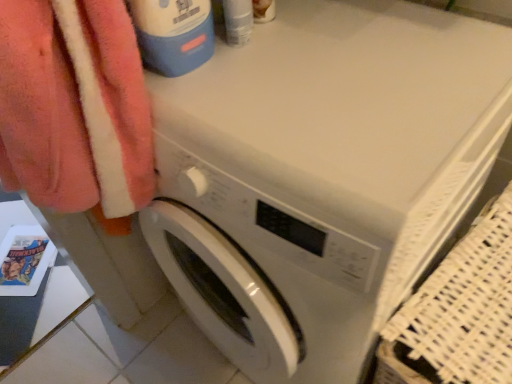
Question: Should I look upward or downward to see white glossy washing machine at center?

Choices:
 (A) down
 (B) up

Answer: (A)

Question: From a real-world perspective, is white glossy washing machine at center beneath blue plastic bottle at upper left?

Choices:
 (A) yes
 (B) no

Answer: (A)

Question: Is white glossy washing machine at center to the left of blue plastic bottle at upper left from the viewer's perspective?

Choices:
 (A) yes
 (B) no

Answer: (B)

Question: Does white glossy washing machine at center lie in front of blue plastic bottle at upper left?

Choices:
 (A) yes
 (B) no

Answer: (A)

Question: Is white glossy washing machine at center in contact with blue plastic bottle at upper left?

Choices:
 (A) yes
 (B) no

Answer: (B)

Question: From a real-world perspective, is white glossy washing machine at center positioned over blue plastic bottle at upper left based on gravity?

Choices:
 (A) no
 (B) yes

Answer: (A)

Question: From the image's perspective, is white glossy washing machine at center below blue plastic bottle at upper left?

Choices:
 (A) yes
 (B) no

Answer: (A)

Question: From a real-world perspective, is blue plastic bottle at upper left below white glossy washing machine at center?

Choices:
 (A) yes
 (B) no

Answer: (B)

Question: Is blue plastic bottle at upper left aimed at white glossy washing machine at center?

Choices:
 (A) yes
 (B) no

Answer: (B)

Question: Is blue plastic bottle at upper left wider than white glossy washing machine at center?

Choices:
 (A) no
 (B) yes

Answer: (A)

Question: From the image's perspective, would you say blue plastic bottle at upper left is shown under white glossy washing machine at center?

Choices:
 (A) no
 (B) yes

Answer: (A)

Question: Is blue plastic bottle at upper left looking in the opposite direction of white glossy washing machine at center?

Choices:
 (A) no
 (B) yes

Answer: (A)

Question: Is blue plastic bottle at upper left thinner than white glossy washing machine at center?

Choices:
 (A) yes
 (B) no

Answer: (A)

Question: From the image's perspective, is blue plastic bottle at upper left located above or below white glossy washing machine at center?

Choices:
 (A) above
 (B) below

Answer: (A)